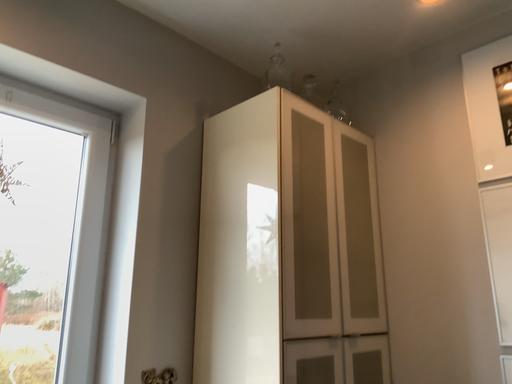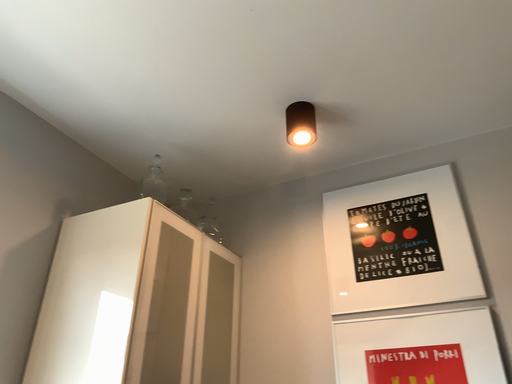
Question: Which way did the camera rotate in the video?

Choices:
 (A) rotated upward
 (B) rotated downward

Answer: (A)